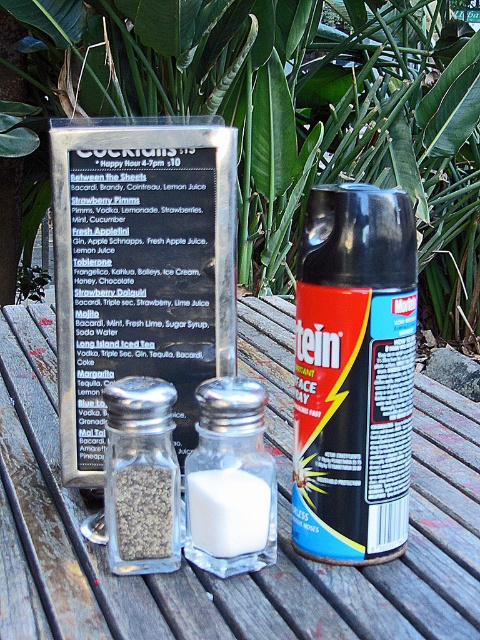
Does transparent glass salt and pepper shakers at center appear under black matte spray can at center?

Correct, transparent glass salt and pepper shakers at center is located below black matte spray can at center.

You are a GUI agent. You are given a task and a screenshot of the screen. Output one action in this format:
    pyautogui.click(x=<x>, y=<y>)
    Task: Click on the transparent glass salt and pepper shakers at center
    This screenshot has width=480, height=640.
    Given the screenshot: What is the action you would take?
    pyautogui.click(x=278, y=522)

Which is below, white glass salt shaker at center or clear glass salt shaker at center?

Positioned lower is clear glass salt shaker at center.

Does white glass salt shaker at center have a greater width compared to clear glass salt shaker at center?

Indeed, white glass salt shaker at center has a greater width compared to clear glass salt shaker at center.

Does point (272, 502) lie behind point (166, 490)?

Yes, it is behind point (166, 490).

Find the location of a particular element. white glass salt shaker at center is located at coordinates (230, 481).

Is point (253, 209) behind point (428, 611)?

Yes, point (253, 209) is farther from viewer.

Image resolution: width=480 pixels, height=640 pixels. I want to click on green leafy plant at center, so click(x=267, y=115).